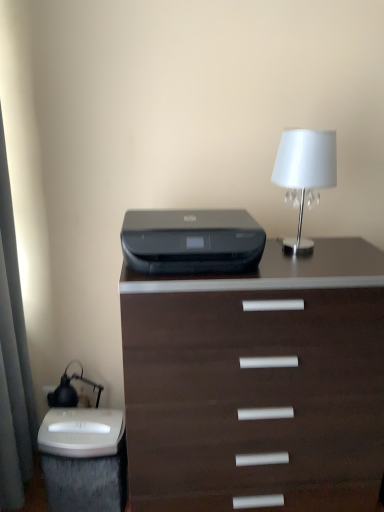
This screenshot has width=384, height=512. What do you see at coordinates (304, 175) in the screenshot?
I see `white glossy lampshade at upper right` at bounding box center [304, 175].

This screenshot has width=384, height=512. Identify the location of dark wood chest of drawers at center. (257, 383).

I want to click on black plastic printer at center, so click(192, 242).

Image resolution: width=384 pixels, height=512 pixels. What are the coordinates of `electric outlet below the white glossy lampshade at upper right (from the image's perspective)` in the screenshot? It's located at (48, 389).

Does white plastic electric outlet at lower left turn towards white glossy lampshade at upper right?

No, white plastic electric outlet at lower left is not turned towards white glossy lampshade at upper right.

Which of these two, white plastic electric outlet at lower left or white glossy lampshade at upper right, is wider?

With larger width is white glossy lampshade at upper right.

Which is correct: white plastic electric outlet at lower left is inside white glossy lampshade at upper right, or outside of it?

white plastic electric outlet at lower left is not enclosed by white glossy lampshade at upper right.

Which of these two, dark wood chest of drawers at center or black plastic printer at center, stands shorter?

With less height is black plastic printer at center.

Considering the sizes of dark wood chest of drawers at center and black plastic printer at center in the image, is dark wood chest of drawers at center bigger or smaller than black plastic printer at center?

Clearly, dark wood chest of drawers at center is larger in size than black plastic printer at center.

Considering the sizes of dark wood chest of drawers at center and black plastic printer at center in the image, is dark wood chest of drawers at center wider or thinner than black plastic printer at center?

In the image, dark wood chest of drawers at center appears to be wider than black plastic printer at center.

Does point (348, 379) come in front of point (245, 231)?

No.

From a real-world perspective, relative to white glossy lampshade at upper right, is black plastic printer at center vertically above or below?

black plastic printer at center is situated lower than white glossy lampshade at upper right in the real world.

How far apart are black plastic printer at center and white glossy lampshade at upper right?

A distance of 35.32 centimeters exists between black plastic printer at center and white glossy lampshade at upper right.

Which is closer, [125,252] or [308,250]?

The point [125,252] is more forward.

Is white glossy lampshade at upper right a part of black plastic printer at center?

No, white glossy lampshade at upper right is located outside of black plastic printer at center.

How many degrees apart are the facing directions of dark wood chest of drawers at center and white glossy lampshade at upper right?

1.54 degrees.

Is dark wood chest of drawers at center with white glossy lampshade at upper right?

No, dark wood chest of drawers at center is not making contact with white glossy lampshade at upper right.

Looking at this image, from a real-world perspective, is dark wood chest of drawers at center below white glossy lampshade at upper right?

Yes.

Does dark wood chest of drawers at center have a lesser height compared to white glossy lampshade at upper right?

Incorrect, the height of dark wood chest of drawers at center does not fall short of that of white glossy lampshade at upper right.

Between dark wood chest of drawers at center and white plastic electric outlet at lower left, which one has less height?

white plastic electric outlet at lower left.

Which is in front, point (255, 439) or point (45, 395)?

Point (255, 439)

What's the angular difference between dark wood chest of drawers at center and white plastic electric outlet at lower left's facing directions?

The angular difference between dark wood chest of drawers at center and white plastic electric outlet at lower left is 1.26 degrees.

Is dark wood chest of drawers at center at the right side of white plastic electric outlet at lower left?

Indeed, dark wood chest of drawers at center is positioned on the right side of white plastic electric outlet at lower left.

Looking at this image, is black plastic printer at center wider or thinner than white plastic electric outlet at lower left?

black plastic printer at center is wider than white plastic electric outlet at lower left.

Is black plastic printer at center beside white plastic electric outlet at lower left?

They are not placed beside each other.

Considering the positions of objects black plastic printer at center and white plastic electric outlet at lower left in the image provided, who is more to the left, black plastic printer at center or white plastic electric outlet at lower left?

From the viewer's perspective, white plastic electric outlet at lower left appears more on the left side.

Is black plastic printer at center outside of white plastic electric outlet at lower left?

That's correct, black plastic printer at center is outside of white plastic electric outlet at lower left.

From a real-world perspective, is white glossy lampshade at upper right on white plastic electric outlet at lower left?

Correct, in the physical world, white glossy lampshade at upper right is higher than white plastic electric outlet at lower left.

Identify the location of bedside lamp above the white plastic electric outlet at lower left (from a real-world perspective). (304, 175).

Considering the sizes of objects white glossy lampshade at upper right and white plastic electric outlet at lower left in the image provided, who is smaller, white glossy lampshade at upper right or white plastic electric outlet at lower left?

white plastic electric outlet at lower left is smaller.

Which of these two, white glossy lampshade at upper right or white plastic electric outlet at lower left, is thinner?

white plastic electric outlet at lower left is thinner.

In order to click on electric outlet beneath the white glossy lampshade at upper right (from a real-world perspective) in this screenshot , I will do `click(48, 389)`.

Locate an element on the screen. Image resolution: width=384 pixels, height=512 pixels. the chest of drawers located below the black plastic printer at center (from the image's perspective) is located at coordinates pos(257,383).

Looking at the image, which one is located further to white glossy lampshade at upper right, black plastic printer at center or white plastic electric outlet at lower left?

Among the two, white plastic electric outlet at lower left is located further to white glossy lampshade at upper right.

Considering their positions, is white plastic electric outlet at lower left positioned further to white glossy lampshade at upper right than black plastic printer at center?

Based on the image, white plastic electric outlet at lower left appears to be further to white glossy lampshade at upper right.

Estimate the real-world distances between objects in this image. Which object is closer to black plastic printer at center, white plastic electric outlet at lower left or dark wood chest of drawers at center?

dark wood chest of drawers at center lies closer to black plastic printer at center than the other object.

Considering their positions, is white plastic electric outlet at lower left positioned closer to black plastic printer at center than white glossy lampshade at upper right?

white glossy lampshade at upper right.

Estimate the real-world distances between objects in this image. Which object is further from dark wood chest of drawers at center, white glossy lampshade at upper right or white plastic electric outlet at lower left?

white plastic electric outlet at lower left is positioned further to the anchor dark wood chest of drawers at center.

From the image, which object appears to be farther from white glossy lampshade at upper right, white plastic electric outlet at lower left or dark wood chest of drawers at center?

white plastic electric outlet at lower left is positioned further to the anchor white glossy lampshade at upper right.

From the image, which object appears to be farther from white plastic electric outlet at lower left, black plastic printer at center or white glossy lampshade at upper right?

white glossy lampshade at upper right lies further to white plastic electric outlet at lower left than the other object.

From the image, which object appears to be nearer to black plastic printer at center, dark wood chest of drawers at center or white glossy lampshade at upper right?

dark wood chest of drawers at center is closer to black plastic printer at center.

You are a GUI agent. You are given a task and a screenshot of the screen. Output one action in this format:
    pyautogui.click(x=<x>, y=<y>)
    Task: Click on the printer between white plastic electric outlet at lower left and white glossy lampshade at upper right
    
    Given the screenshot: What is the action you would take?
    pyautogui.click(x=192, y=242)

Locate an element on the screen. The height and width of the screenshot is (512, 384). printer between white glossy lampshade at upper right and dark wood chest of drawers at center in the up-down direction is located at coordinates (192, 242).

In order to click on printer located between dark wood chest of drawers at center and white plastic electric outlet at lower left in the depth direction in this screenshot , I will do `click(192, 242)`.

Find the location of a particular element. This screenshot has height=512, width=384. the chest of drawers situated between white plastic electric outlet at lower left and white glossy lampshade at upper right from left to right is located at coordinates point(257,383).